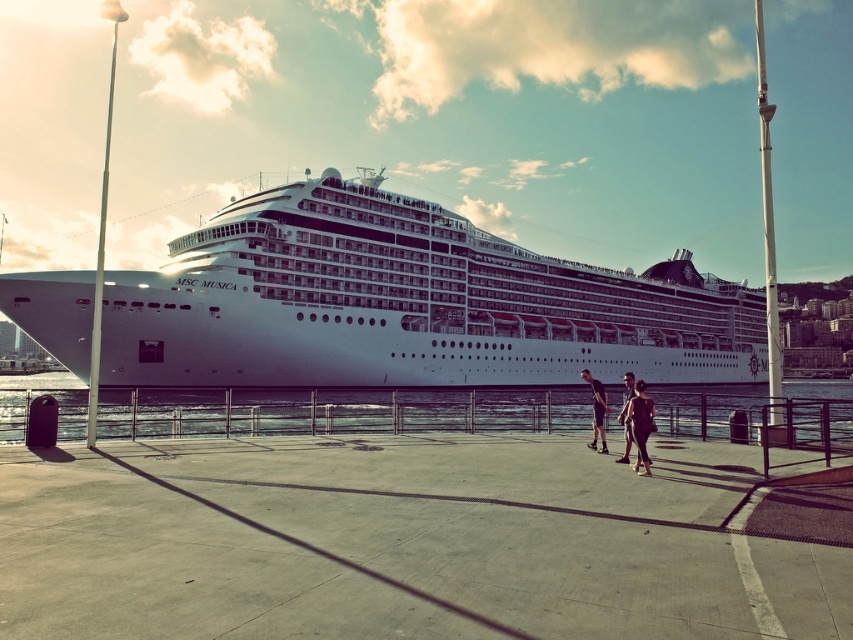
Question: Does white glossy cruise ship at center have a larger size compared to dark gray fabric pants at center?

Choices:
 (A) no
 (B) yes

Answer: (B)

Question: Which object is closer to the camera taking this photo?

Choices:
 (A) matte black clothing at center
 (B) matte black shorts at center
 (C) matte black swimsuit at center

Answer: (C)

Question: Does matte black clothing at center come in front of dark gray fabric pants at center?

Choices:
 (A) yes
 (B) no

Answer: (A)

Question: Which is farther from the matte black clothing at center?

Choices:
 (A) matte black swimsuit at center
 (B) white glossy cruise ship at center
 (C) dark gray fabric pants at center

Answer: (B)

Question: Which object is positioned farthest from the matte black shorts at center?

Choices:
 (A) matte black clothing at center
 (B) white glossy cruise ship at center
 (C) matte black swimsuit at center

Answer: (B)

Question: Can you confirm if white glossy cruise ship at center is positioned to the left of matte black clothing at center?

Choices:
 (A) yes
 (B) no

Answer: (A)